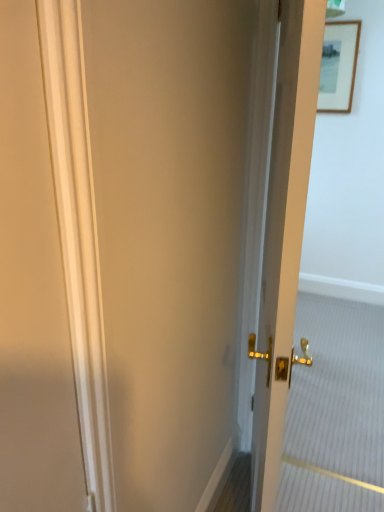
Question: Is wooden framed picture at upper right in front of or behind matte gold door at center in the image?

Choices:
 (A) front
 (B) behind

Answer: (B)

Question: Is wooden framed picture at upper right inside the boundaries of matte gold door at center, or outside?

Choices:
 (A) outside
 (B) inside

Answer: (A)

Question: From a real-world perspective, is wooden framed picture at upper right positioned above or below matte gold door at center?

Choices:
 (A) below
 (B) above

Answer: (B)

Question: From their relative heights in the image, would you say matte gold door at center is taller or shorter than wooden framed picture at upper right?

Choices:
 (A) short
 (B) tall

Answer: (B)

Question: Considering their positions, is matte gold door at center located in front of or behind wooden framed picture at upper right?

Choices:
 (A) behind
 (B) front

Answer: (B)

Question: Is matte gold door at center bigger or smaller than wooden framed picture at upper right?

Choices:
 (A) big
 (B) small

Answer: (A)

Question: In terms of width, does matte gold door at center look wider or thinner when compared to wooden framed picture at upper right?

Choices:
 (A) thin
 (B) wide

Answer: (B)